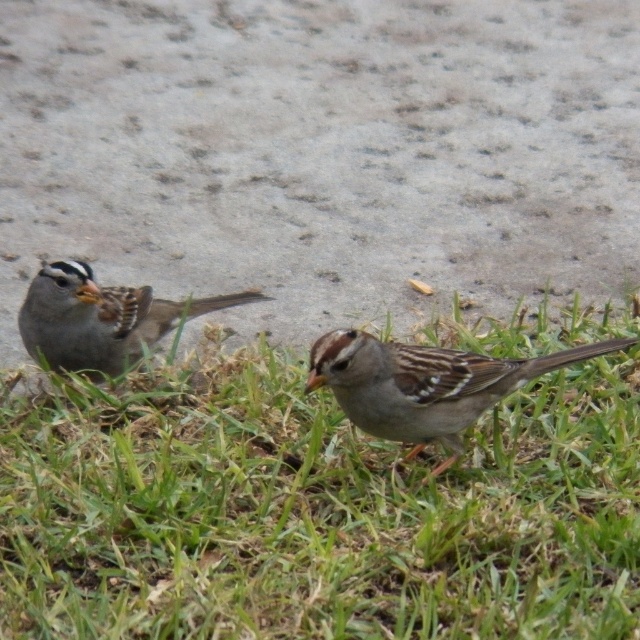
Can you confirm if brown speckled sparrow at center is positioned below brown speckled sparrow at left?

Yes, brown speckled sparrow at center is below brown speckled sparrow at left.

The height and width of the screenshot is (640, 640). What do you see at coordinates (424, 385) in the screenshot?
I see `brown speckled sparrow at center` at bounding box center [424, 385].

Identify the location of brown speckled sparrow at center. (424, 385).

Can you confirm if green grass at lower center is positioned below brown speckled sparrow at center?

Correct, green grass at lower center is located below brown speckled sparrow at center.

Between green grass at lower center and brown speckled sparrow at center, which one is positioned higher?

brown speckled sparrow at center

At what (x,y) coordinates should I click in order to perform the action: click on green grass at lower center. Please return your answer as a coordinate pair (x, y). The width and height of the screenshot is (640, 640). Looking at the image, I should click on (310, 509).

I want to click on green grass at lower center, so click(x=310, y=509).

Who is taller, green grass at lower center or brown speckled sparrow at left?

Standing taller between the two is green grass at lower center.

Is green grass at lower center to the left of brown speckled sparrow at left from the viewer's perspective?

Incorrect, green grass at lower center is not on the left side of brown speckled sparrow at left.

This screenshot has height=640, width=640. I want to click on green grass at lower center, so click(310, 509).

I want to click on green grass at lower center, so click(x=310, y=509).